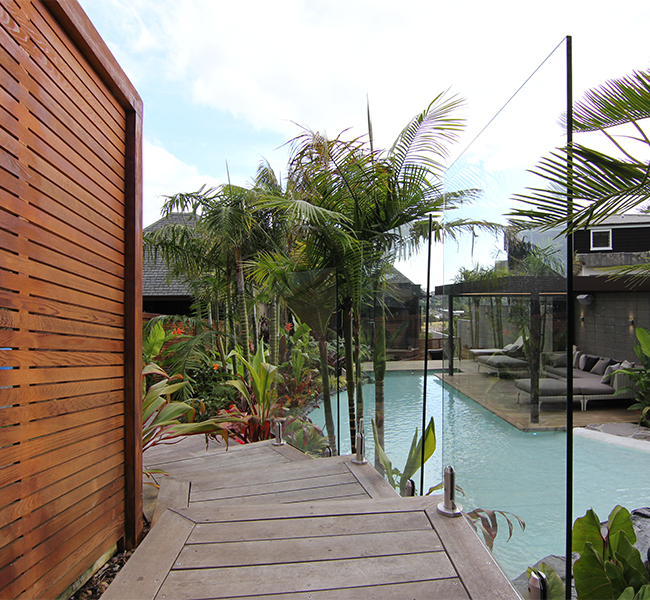
Where is `wood paneling`? wood paneling is located at coordinates (68, 485).